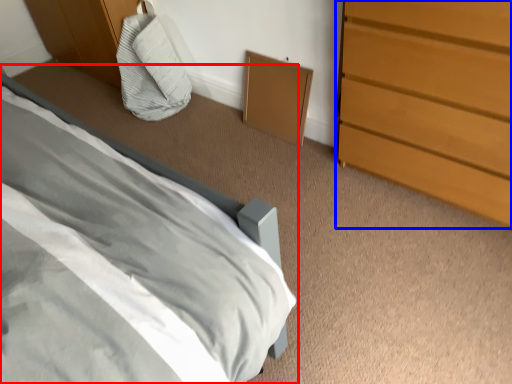
Question: Which point is further to the camera, bed (highlighted by a red box) or chest of drawers (highlighted by a blue box)?

Choices:
 (A) bed
 (B) chest of drawers

Answer: (B)